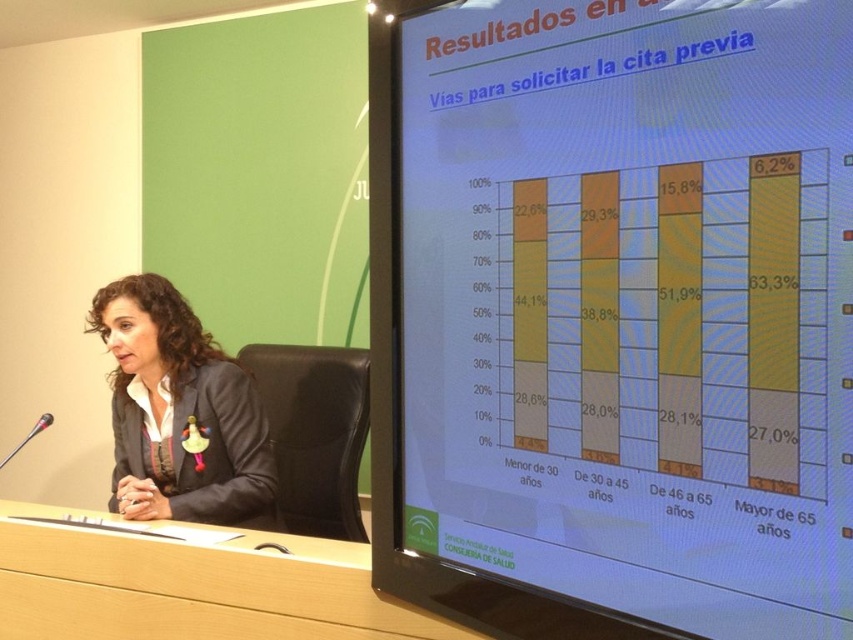
Is point (628, 545) farther from camera compared to point (112, 499)?

That is False.

Which is behind, point (648, 556) or point (152, 426)?

Positioned behind is point (152, 426).

I want to click on matte yellow bar chart at right, so coord(613,316).

Is matte gray blazer at center closer to the viewer compared to wooden at center?

No, matte gray blazer at center is behind wooden at center.

Is point (144, 333) less distant than point (277, 604)?

No, (144, 333) is further to viewer.

This screenshot has width=853, height=640. Identify the location of matte gray blazer at center. pos(178,412).

Does matte yellow bar chart at right have a lesser width compared to wooden at center?

Yes, matte yellow bar chart at right is thinner than wooden at center.

Is point (439, 429) closer to camera compared to point (316, 560)?

Yes, point (439, 429) is closer to viewer.

Does point (459, 84) lie in front of point (291, 566)?

Yes, it is in front of point (291, 566).

In order to click on matte yellow bar chart at right in this screenshot , I will do `click(613, 316)`.